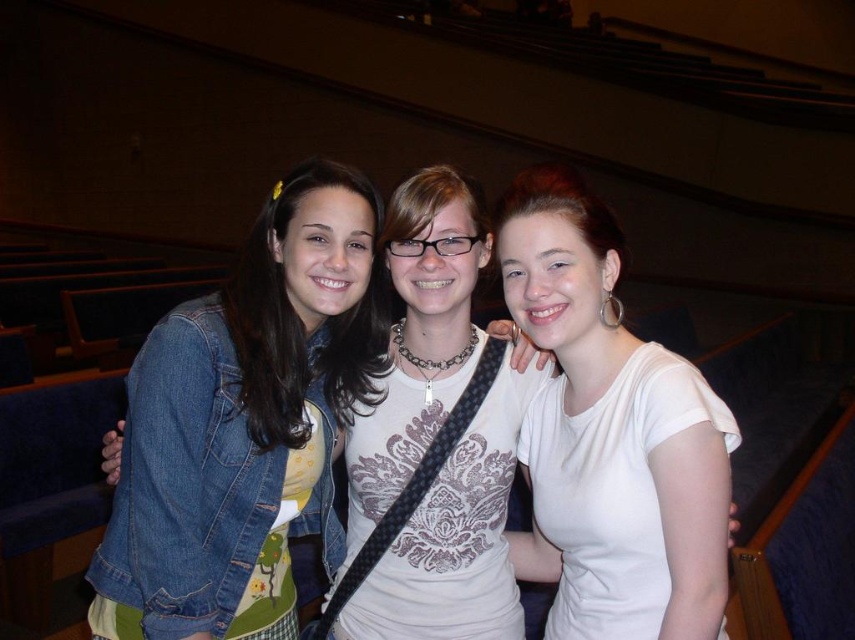
Does point (629, 577) lie behind point (460, 301)?

No.

Locate an element on the screen. The image size is (855, 640). white matte shirt at center is located at coordinates (611, 435).

Consider the image. Is denim jacket at left closer to camera compared to white matte shirt at center?

No.

Can you confirm if denim jacket at left is wider than white matte shirt at center?

Yes, denim jacket at left is wider than white matte shirt at center.

Who is more distant from viewer, (x=237, y=442) or (x=516, y=237)?

Positioned behind is point (x=237, y=442).

At what (x,y) coordinates should I click in order to perform the action: click on denim jacket at left. Please return your answer as a coordinate pair (x, y). Image resolution: width=855 pixels, height=640 pixels. Looking at the image, I should click on (243, 424).

Who is more distant from viewer, (156, 458) or (493, 547)?

Point (493, 547)

Is point (180, 419) behind point (380, 595)?

No, it is in front of (380, 595).

What are the coordinates of `denim jacket at left` in the screenshot? It's located at (243, 424).

This screenshot has width=855, height=640. I want to click on denim jacket at left, so click(243, 424).